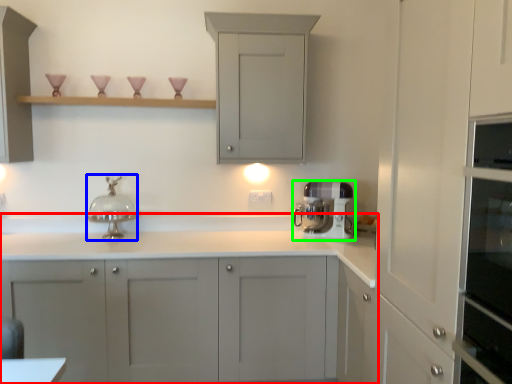
Question: Which object is the farthest from cabinetry (highlighted by a red box)? Choose among these: faucet (highlighted by a blue box) or home appliance (highlighted by a green box).

Choices:
 (A) faucet
 (B) home appliance

Answer: (A)